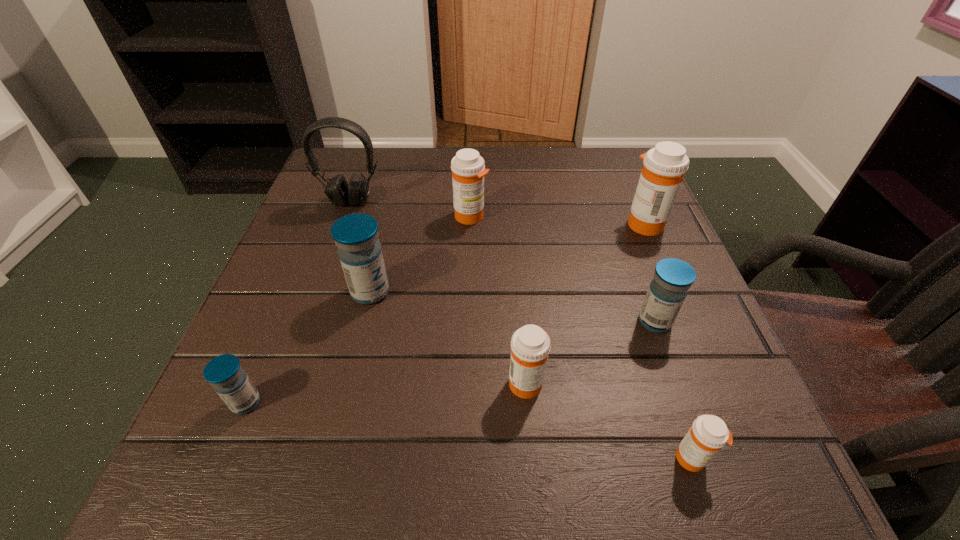
What are the coordinates of `headset` in the screenshot? It's located at (339, 192).

Locate an element on the screen. The width and height of the screenshot is (960, 540). the biggest orange medicine is located at coordinates (664, 166).

Locate an element on the screen. This screenshot has height=540, width=960. the rightmost orange medicine is located at coordinates tap(664, 166).

Find the location of a particular element. The width and height of the screenshot is (960, 540). the fifth object from right to left is located at coordinates (468, 169).

The height and width of the screenshot is (540, 960). Find the location of `the leftmost orange medicine`. the leftmost orange medicine is located at coordinates (468, 169).

Find the location of a particular element. the fifth nearest object is located at coordinates (356, 235).

Find the location of a particular element. The width and height of the screenshot is (960, 540). the second blue medicine from left to right is located at coordinates (356, 235).

Where is `the fourth medicine from left to right`? The width and height of the screenshot is (960, 540). the fourth medicine from left to right is located at coordinates (530, 345).

Image resolution: width=960 pixels, height=540 pixels. What are the coordinates of `the fifth object from left to right` in the screenshot? It's located at (530, 345).

Identify the location of the second smallest blue medicine. (667, 291).